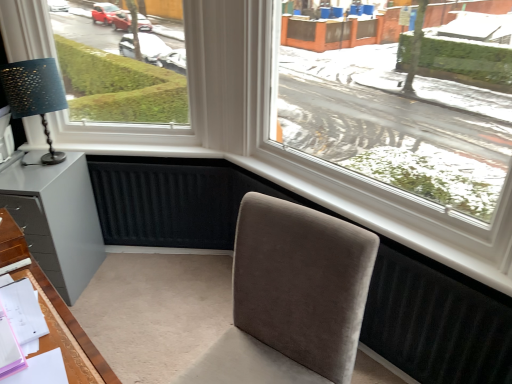
The image size is (512, 384). Find the location of `matte gray cabinet at lower left`. matte gray cabinet at lower left is located at coordinates (57, 220).

Looking at this image, what is the approximate width of suede-like beige chair at center?

It is 24.58 inches.

You are a GUI agent. You are given a task and a screenshot of the screen. Output one action in this format:
    pyautogui.click(x=<x>, y=<y>)
    Task: Click on the matte gray cabinet at lower left
    
    Given the screenshot: What is the action you would take?
    pyautogui.click(x=57, y=220)

Between matte black lampshade at left and transparent glass window at center, which one has more height?

Standing taller between the two is transparent glass window at center.

From the picture: Is matte black lampshade at left inside or outside of transparent glass window at center?

matte black lampshade at left is not inside transparent glass window at center, it's outside.

Consider the image. From the image's perspective, is matte black lampshade at left located beneath transparent glass window at center?

No.

Is suede-like beige chair at center not near matte black lampshade at left?

suede-like beige chair at center is positioned a significant distance from matte black lampshade at left.

From the picture: Can you confirm if suede-like beige chair at center is positioned to the right of matte black lampshade at left?

Correct, you'll find suede-like beige chair at center to the right of matte black lampshade at left.

From the image's perspective, is suede-like beige chair at center located above or below matte black lampshade at left?

Clearly, from the image's perspective, suede-like beige chair at center is below matte black lampshade at left.

Does suede-like beige chair at center lie in front of matte black lampshade at left?

Yes, it is.

This screenshot has width=512, height=384. Identify the location of chair that is under the white plastic window at upper left (from a real-world perspective). (291, 298).

Can you confirm if suede-like beige chair at center is positioned to the left of white plastic window at upper left?

No, suede-like beige chair at center is not to the left of white plastic window at upper left.

From the image's perspective, is suede-like beige chair at center under white plastic window at upper left?

Correct, suede-like beige chair at center appears lower than white plastic window at upper left in the image.

Which object is closer to the camera taking this photo, suede-like beige chair at center or white plastic window at upper left?

suede-like beige chair at center is more forward.

Identify the location of chair on the left of transparent glass window at center. (291, 298).

Is suede-like beige chair at center oriented away from transparent glass window at center?

Yes.

Relative to transparent glass window at center, is suede-like beige chair at center in front or behind?

Clearly, suede-like beige chair at center is in front of transparent glass window at center.

Is matte gray cabinet at lower left at the left side of transparent glass window at center?

Yes, matte gray cabinet at lower left is to the left of transparent glass window at center.

Is matte gray cabinet at lower left not near transparent glass window at center?

Yes, matte gray cabinet at lower left and transparent glass window at center are located far from each other.

Considering their positions, is matte gray cabinet at lower left located in front of or behind transparent glass window at center?

In the image, matte gray cabinet at lower left appears behind transparent glass window at center.

Is suede-like beige chair at center oriented away from matte gray cabinet at lower left?

That's not correct — suede-like beige chair at center is not looking away from matte gray cabinet at lower left.

From the image's perspective, is suede-like beige chair at center positioned above or below matte gray cabinet at lower left?

From the image's perspective, suede-like beige chair at center appears below matte gray cabinet at lower left.

Which is correct: suede-like beige chair at center is inside matte gray cabinet at lower left, or outside of it?

suede-like beige chair at center is not inside matte gray cabinet at lower left, it's outside.

Between suede-like beige chair at center and matte gray cabinet at lower left, which one is positioned in front?

suede-like beige chair at center is closer to the camera.

Is white plastic window at upper left oriented away from matte black lampshade at left?

white plastic window at upper left does not have its back to matte black lampshade at left.

Looking at this image, considering the sizes of objects white plastic window at upper left and matte black lampshade at left in the image provided, who is bigger, white plastic window at upper left or matte black lampshade at left?

white plastic window at upper left is bigger.

From the image's perspective, is white plastic window at upper left located above or below matte black lampshade at left?

Based on their image positions, white plastic window at upper left is located above matte black lampshade at left.

Which is behind, point (143, 136) or point (65, 103)?

The point (143, 136) is farther.

Locate an element on the screen. The image size is (512, 384). table lamp beneath the transparent glass window at center (from a real-world perspective) is located at coordinates (35, 95).

Locate an element on the screen. The image size is (512, 384). table lamp above the suede-like beige chair at center (from the image's perspective) is located at coordinates (35, 95).

From the image, which object appears to be nearer to suede-like beige chair at center, white plastic window at upper left or matte black lampshade at left?

white plastic window at upper left is positioned closer to the anchor suede-like beige chair at center.

From the image, which object appears to be farther from suede-like beige chair at center, transparent glass window at center or matte black lampshade at left?

matte black lampshade at left lies further to suede-like beige chair at center than the other object.

Estimate the real-world distances between objects in this image. Which object is closer to transparent glass window at center, matte gray cabinet at lower left or suede-like beige chair at center?

Among the two, suede-like beige chair at center is located nearer to transparent glass window at center.

Estimate the real-world distances between objects in this image. Which object is further from white plastic window at upper left, suede-like beige chair at center or matte gray cabinet at lower left?

suede-like beige chair at center.

Which object lies nearer to the anchor point matte black lampshade at left, matte gray cabinet at lower left or transparent glass window at center?

matte gray cabinet at lower left.

Based on their spatial positions, is suede-like beige chair at center or white plastic window at upper left further from transparent glass window at center?

Answer: suede-like beige chair at center is positioned further to the anchor transparent glass window at center.

Which object lies nearer to the anchor point white plastic window at upper left, suede-like beige chair at center or matte black lampshade at left?

Among the two, matte black lampshade at left is located nearer to white plastic window at upper left.

Looking at the image, which one is located closer to matte gray cabinet at lower left, transparent glass window at center or matte black lampshade at left?

matte black lampshade at left is closer to matte gray cabinet at lower left.

The image size is (512, 384). What are the coordinates of `table lamp between matte gray cabinet at lower left and transparent glass window at center` in the screenshot? It's located at (35, 95).

Identify the location of table lamp between white plastic window at upper left and matte gray cabinet at lower left in the up-down direction. (35, 95).

At what (x,y) coordinates should I click in order to perform the action: click on window between matte black lampshade at left and transparent glass window at center. Please return your answer as a coordinate pair (x, y). The width and height of the screenshot is (512, 384). Looking at the image, I should click on (163, 124).

The width and height of the screenshot is (512, 384). I want to click on chair between matte black lampshade at left and transparent glass window at center from left to right, so click(291, 298).